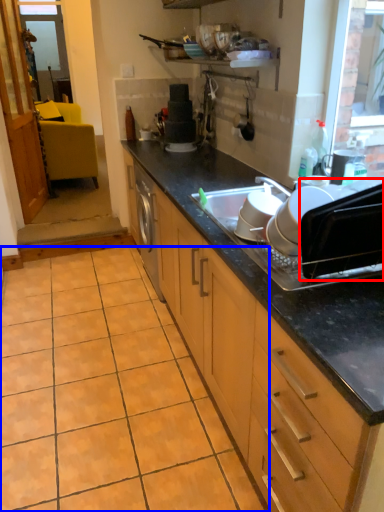
Question: Which of the following is the closest to the observer, appliance (highlighted by a red box) or ceramic tile (highlighted by a blue box)?

Choices:
 (A) appliance
 (B) ceramic tile

Answer: (A)